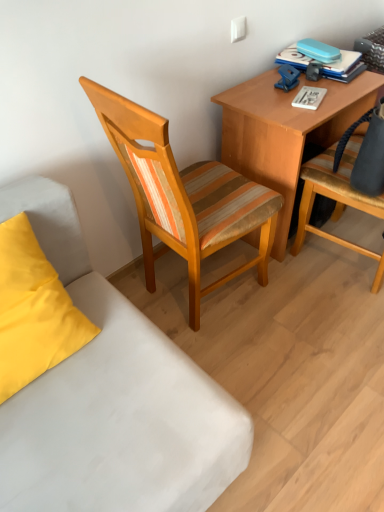
Identify the location of vacant space in front of striped fabric chair at right, placed as the 2th chair when sorted from left to right. (339, 328).